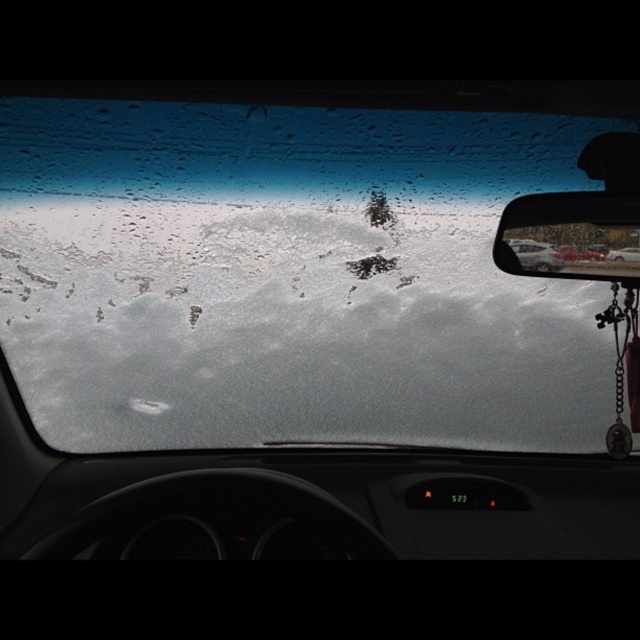
In order to click on frosted glass windshield at center in this screenshot , I will do `click(289, 276)`.

Does frosted glass windshield at center appear on the right side of shiny plastic rearview mirror at upper right?

Incorrect, frosted glass windshield at center is not on the right side of shiny plastic rearview mirror at upper right.

Does point (292, 196) come closer to viewer compared to point (628, 224)?

No, (292, 196) is behind (628, 224).

Where is `frosted glass windshield at center`? The height and width of the screenshot is (640, 640). frosted glass windshield at center is located at coordinates (289, 276).